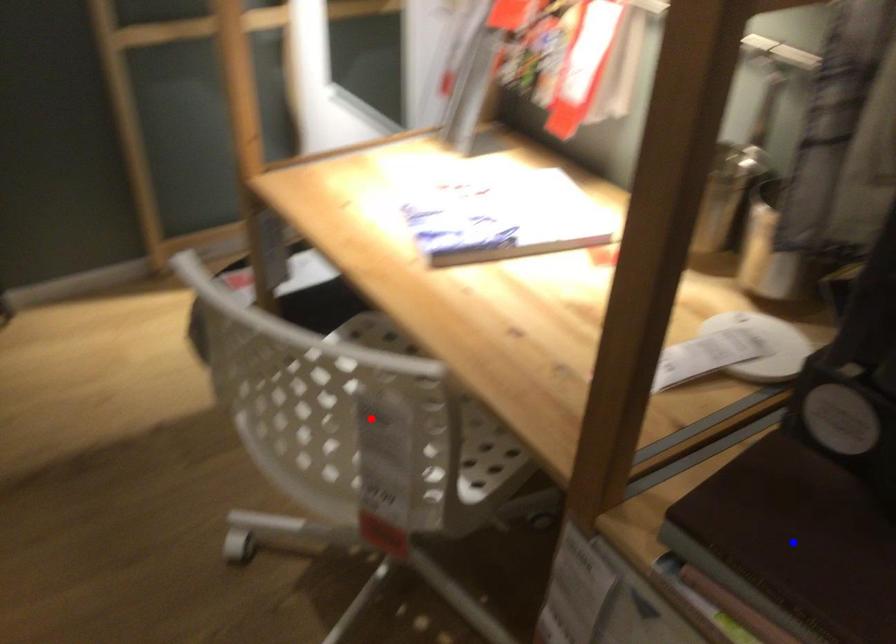
Question: In the image, two points are highlighted. Which point is nearer to the camera? Reply with the corresponding letter.

Choices:
 (A) blue point
 (B) red point

Answer: (A)